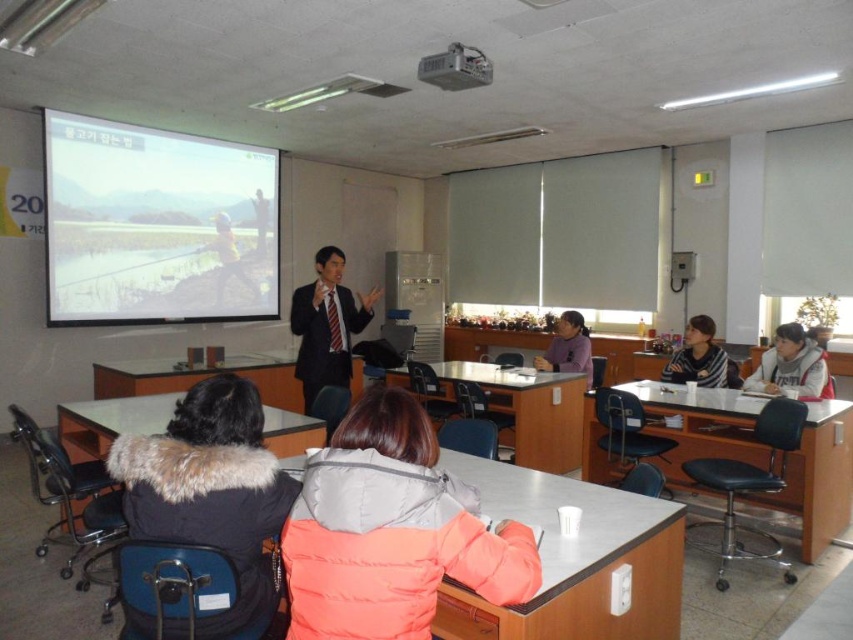
In the classroom scene, there are several students wearing winter clothing. You are standing at the point marked by the coordinates point (392, 531). What is the nearest object to you among the students?

The nearest object to you at point (392, 531) is the orange puffer jacket at lower center, as the coordinates indicate that location.